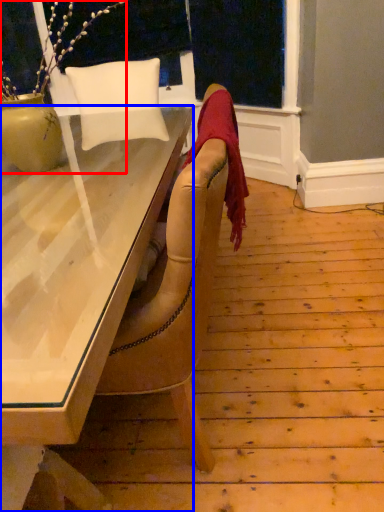
Question: Which object is closer to the camera taking this photo, houseplant (highlighted by a red box) or desk (highlighted by a blue box)?

Choices:
 (A) houseplant
 (B) desk

Answer: (B)